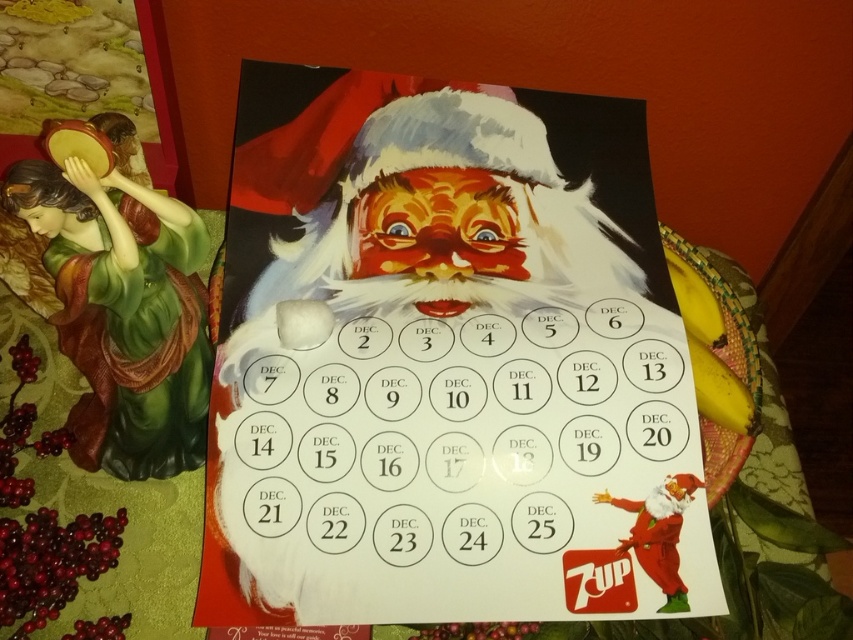
Between matte paper calendar at center and shiny red santa at center, which one appears on the left side from the viewer's perspective?

From the viewer's perspective, shiny red santa at center appears more on the left side.

Can you confirm if matte paper calendar at center is positioned to the right of shiny red santa at center?

Indeed, matte paper calendar at center is positioned on the right side of shiny red santa at center.

Does point (280, 108) come behind point (392, 109)?

No, (280, 108) is closer to viewer.

Locate an element on the screen. The height and width of the screenshot is (640, 853). matte paper calendar at center is located at coordinates (447, 364).

The height and width of the screenshot is (640, 853). I want to click on matte paper calendar at center, so click(447, 364).

Does matte paper calendar at center appear over red velvet santa at lower right?

Yes, matte paper calendar at center is above red velvet santa at lower right.

The image size is (853, 640). Identify the location of matte paper calendar at center. (447, 364).

This screenshot has height=640, width=853. Find the location of `matte paper calendar at center`. matte paper calendar at center is located at coordinates (447, 364).

Which is behind, point (149, 237) or point (593, 500)?

The point (593, 500) is more distant.

From the picture: Is green glossy statue at left bigger than red velvet santa at lower right?

Correct, green glossy statue at left is larger in size than red velvet santa at lower right.

Measure the distance between green glossy statue at left and camera.

A distance of 57.68 centimeters exists between green glossy statue at left and camera.

This screenshot has width=853, height=640. I want to click on green glossy statue at left, so click(123, 314).